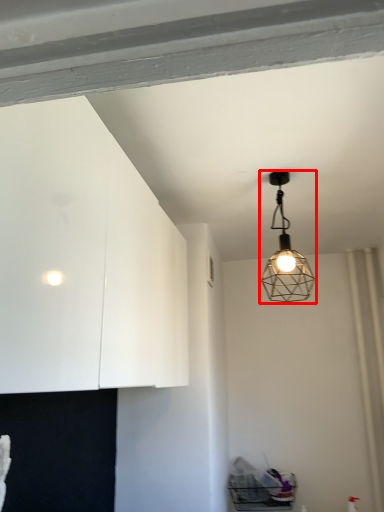
Question: From the image's perspective, where is lamp (annotated by the red box) located relative to dresser?

Choices:
 (A) below
 (B) above

Answer: (B)